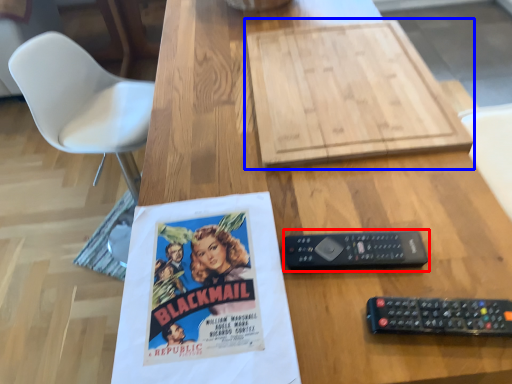
Question: Which object appears farthest to the camera in this image, control (highlighted by a red box) or cardboard (highlighted by a blue box)?

Choices:
 (A) control
 (B) cardboard

Answer: (B)